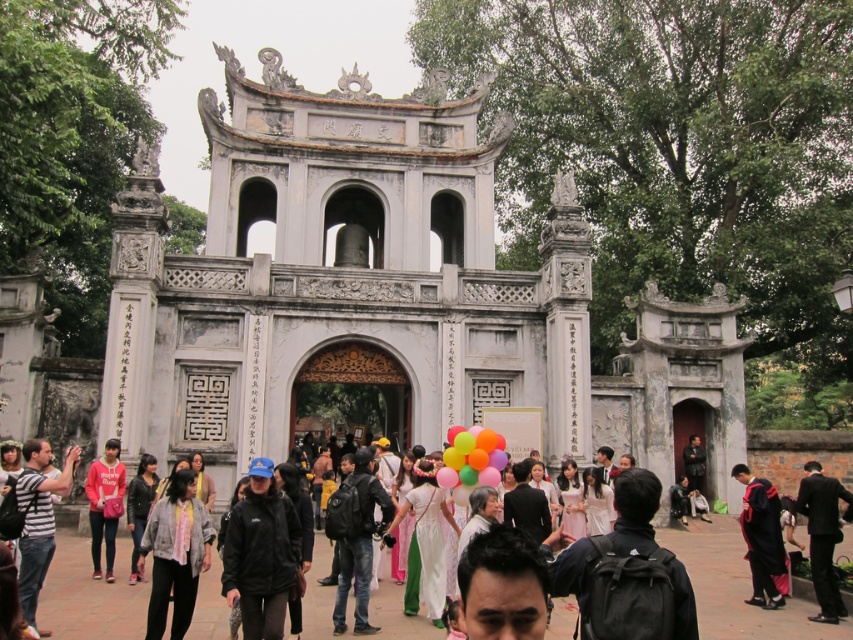
Between point (30, 621) and point (827, 524), which one is positioned in front?

Point (30, 621)

Is striped cotton shirt at lower left smaller than black suit at right?

Correct, striped cotton shirt at lower left occupies less space than black suit at right.

Is point (38, 481) positioned in front of point (824, 477)?

Yes.

In order to click on striped cotton shirt at lower left in this screenshot , I will do `click(38, 516)`.

Is black matte jacket at center smaller than white satin dress at center?

No.

Who is more distant from viewer, (235, 525) or (595, 474)?

The point (595, 474) is behind.

I want to click on black matte jacket at center, so click(x=260, y=554).

Is matte gray jacket at center to the right of pink satin dress at center from the viewer's perspective?

No, matte gray jacket at center is not to the right of pink satin dress at center.

Is the position of matte gray jacket at center less distant than that of pink satin dress at center?

Yes, it is in front of pink satin dress at center.

Measure the distance between matte gray jacket at center and camera.

The distance of matte gray jacket at center from camera is 113.00 feet.

This screenshot has height=640, width=853. Find the location of `matte gray jacket at center`. matte gray jacket at center is located at coordinates (x=175, y=554).